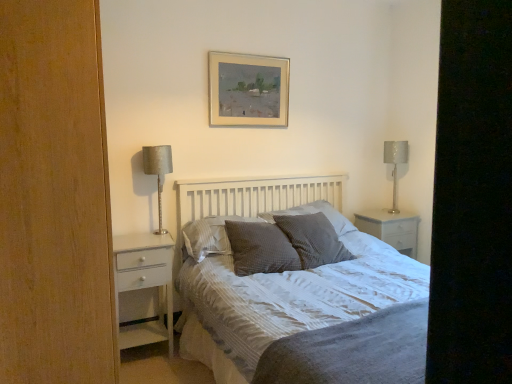
Question: Is gray textured pillow at center, acting as the 2th pillow starting from the left, spatially inside black matte screen door at right, or outside of it?

Choices:
 (A) inside
 (B) outside

Answer: (B)

Question: Does point (245, 264) appear closer or farther from the camera than point (459, 77)?

Choices:
 (A) closer
 (B) farther

Answer: (B)

Question: Which object is positioned farthest from the waffle-textured gray pillow at center, placed as the second pillow when sorted from right to left?

Choices:
 (A) gray textured pillow at center, the fourth pillow from the right
 (B) white glossy nightstand at right
 (C) textured gray bed at center
 (D) black matte screen door at right
 (E) gray textured pillow at center, which is counted as the 1th pillow, starting from the right

Answer: (D)

Question: Estimate the real-world distances between objects in this image. Which object is farther from the white glossy chest of drawers at left?

Choices:
 (A) gray textured pillow at center, the 3th pillow viewed from the right
 (B) silver metallic picture frame at upper center
 (C) waffle-textured gray pillow at center, placed as the second pillow when sorted from right to left
 (D) white glossy nightstand at right
 (E) gray textured pillow at center, the first pillow viewed from the left

Answer: (D)